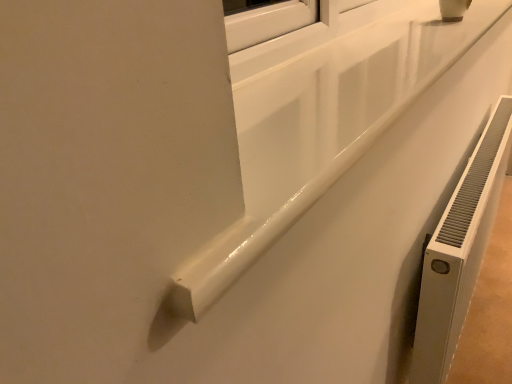
Measure the distance between point [446,259] and camera.

Point [446,259] is 28.19 inches away from camera.

I want to click on white metallic radiator at right, so click(459, 250).

What do you see at coordinates (459, 250) in the screenshot? I see `white metallic radiator at right` at bounding box center [459, 250].

In order to click on white metallic radiator at right in this screenshot , I will do `click(459, 250)`.